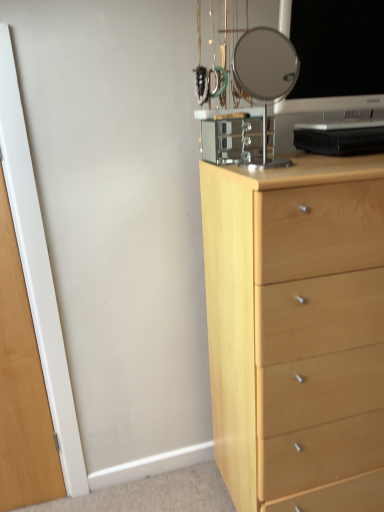
Locate an element on the screen. The image size is (384, 512). vacant space in front of clear glass mirror at upper center is located at coordinates (283, 173).